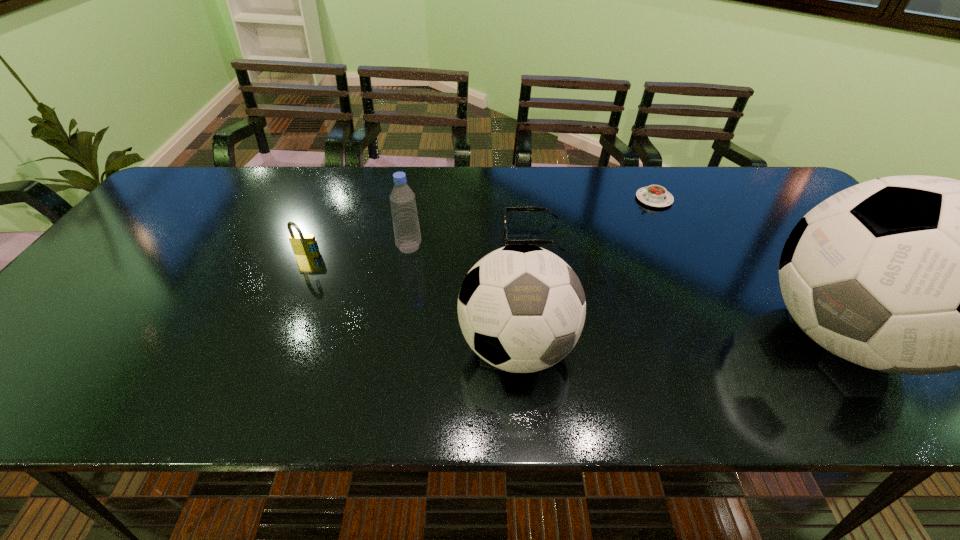
Locate an element on the screen. The width and height of the screenshot is (960, 540). vacant area between the second shortest object and the farthest object is located at coordinates (593, 218).

Locate an element on the screen. vacant area that lies between the leftmost object and the sunglasses is located at coordinates (420, 246).

Identify the location of vacant space that's between the padlock and the farthest object. (480, 227).

Where is `free space between the left soccer ball and the leftmost object`? The image size is (960, 540). free space between the left soccer ball and the leftmost object is located at coordinates (412, 301).

Identify the location of object that can be found as the fifth closest to the left soccer ball. The width and height of the screenshot is (960, 540). (654, 195).

Find the location of a particular element. The width and height of the screenshot is (960, 540). object that is the second closest to the fifth object from right to left is located at coordinates (521, 308).

The width and height of the screenshot is (960, 540). I want to click on vacant area in the image that satisfies the following two spatial constraints: 1. at the front lenses of the fifth tallest object; 2. on the side with the combination dials of the padlock, so click(x=535, y=255).